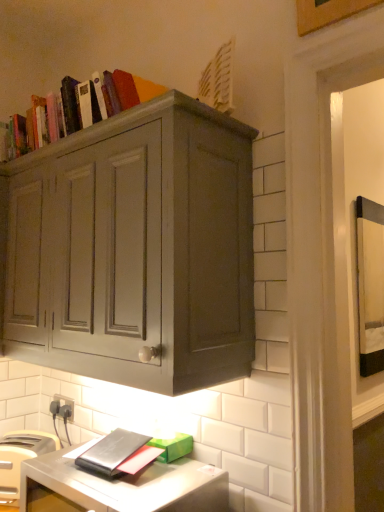
In order to face metallic silver computer desk at lower left, should I rotate leftwards or rightwards?

You should rotate left by 9.786 degrees.

Describe the element at coordinates (20, 460) in the screenshot. I see `white plastic toaster at lower left` at that location.

Describe the element at coordinates (66, 404) in the screenshot. I see `black plastic electric outlet at lower left` at that location.

Locate an element on the screen. metallic silver computer desk at lower left is located at coordinates (121, 486).

Can you confirm if metallic silver computer desk at lower left is smaller than white plastic toaster at lower left?

Incorrect, metallic silver computer desk at lower left is not smaller in size than white plastic toaster at lower left.

How different are the orientations of metallic silver computer desk at lower left and white plastic toaster at lower left in degrees?

The facing directions of metallic silver computer desk at lower left and white plastic toaster at lower left are 32.7 degrees apart.

In the image, is metallic silver computer desk at lower left positioned in front of or behind white plastic toaster at lower left?

metallic silver computer desk at lower left is positioned closer to the viewer than white plastic toaster at lower left.

Which of these two, metallic silver computer desk at lower left or white plastic toaster at lower left, is thinner?

With smaller width is white plastic toaster at lower left.

From a real-world perspective, is white plastic toaster at lower left positioned above or below wooden picture frame at upper right?

white plastic toaster at lower left is situated lower than wooden picture frame at upper right in the real world.

Does white plastic toaster at lower left come behind wooden picture frame at upper right?

Yes, the depth of white plastic toaster at lower left is greater than that of wooden picture frame at upper right.

Can you tell me how much white plastic toaster at lower left and wooden picture frame at upper right differ in facing direction?

The angle between the facing direction of white plastic toaster at lower left and the facing direction of wooden picture frame at upper right is 33.4 degrees.

Is white plastic toaster at lower left positioned with its back to wooden picture frame at upper right?

No.

Does black plastic electric outlet at lower left turn towards metallic silver computer desk at lower left?

No, black plastic electric outlet at lower left does not turn towards metallic silver computer desk at lower left.

Based on the photo, is black plastic electric outlet at lower left inside the boundaries of metallic silver computer desk at lower left, or outside?

black plastic electric outlet at lower left is located beyond the bounds of metallic silver computer desk at lower left.

Consider the image. From a real-world perspective, is black plastic electric outlet at lower left located beneath metallic silver computer desk at lower left?

No, from a real-world perspective, black plastic electric outlet at lower left is not beneath metallic silver computer desk at lower left.

From the image's perspective, is black plastic electric outlet at lower left on top of metallic silver computer desk at lower left?

Yes, from the image's perspective, black plastic electric outlet at lower left is above metallic silver computer desk at lower left.

Can you confirm if wooden picture frame at upper right is taller than white plastic toaster at lower left?

Yes, wooden picture frame at upper right is taller than white plastic toaster at lower left.

From the image's perspective, is wooden picture frame at upper right above white plastic toaster at lower left?

Yes, from the image's perspective, wooden picture frame at upper right is on top of white plastic toaster at lower left.

Considering the positions of point (321, 26) and point (47, 449), is point (321, 26) closer or farther from the camera than point (47, 449)?

Clearly, point (321, 26) is closer to the camera than point (47, 449).

Would you say wooden picture frame at upper right is outside white plastic toaster at lower left?

wooden picture frame at upper right lies outside white plastic toaster at lower left's area.

Does black plastic electric outlet at lower left have a greater height compared to matte gray cabinet at upper center?

Incorrect, the height of black plastic electric outlet at lower left is not larger of that of matte gray cabinet at upper center.

Is there a large distance between black plastic electric outlet at lower left and matte gray cabinet at upper center?

black plastic electric outlet at lower left is near matte gray cabinet at upper center, not far away.

Is black plastic electric outlet at lower left not inside matte gray cabinet at upper center?

Indeed, black plastic electric outlet at lower left is completely outside matte gray cabinet at upper center.

From a real-world perspective, relative to black plastic electric outlet at lower left, is metallic silver computer desk at lower left vertically above or below?

Clearly, from a real-world perspective, metallic silver computer desk at lower left is below black plastic electric outlet at lower left.

Is metallic silver computer desk at lower left oriented towards black plastic electric outlet at lower left?

No, metallic silver computer desk at lower left is not facing towards black plastic electric outlet at lower left.

In the scene shown: Does metallic silver computer desk at lower left appear on the right side of black plastic electric outlet at lower left?

Yes, metallic silver computer desk at lower left is to the right of black plastic electric outlet at lower left.

Identify the location of computer desk below the black plastic electric outlet at lower left (from the image's perspective). This screenshot has height=512, width=384. (121, 486).

Does wooden picture frame at upper right have a larger size compared to black plastic electric outlet at lower left?

Yes, wooden picture frame at upper right is bigger than black plastic electric outlet at lower left.

Does wooden picture frame at upper right turn towards black plastic electric outlet at lower left?

No, wooden picture frame at upper right is not turned towards black plastic electric outlet at lower left.

Which object is positioned more to the right, wooden picture frame at upper right or black plastic electric outlet at lower left?

wooden picture frame at upper right is more to the right.

I want to click on computer desk in front of the white plastic toaster at lower left, so click(121, 486).

Where is `picture frame above the white plastic toaster at lower left (from the image's perspective)`? The height and width of the screenshot is (512, 384). picture frame above the white plastic toaster at lower left (from the image's perspective) is located at coordinates (327, 12).

Based on the photo, based on their spatial positions, is metallic silver computer desk at lower left or white plastic toaster at lower left closer to matte gray cabinet at upper center?

metallic silver computer desk at lower left is closer to matte gray cabinet at upper center.

Which object lies further to the anchor point metallic silver computer desk at lower left, wooden picture frame at upper right or white plastic toaster at lower left?

wooden picture frame at upper right.

Looking at the image, which one is located further to white plastic toaster at lower left, black plastic electric outlet at lower left or metallic silver computer desk at lower left?

black plastic electric outlet at lower left.

When comparing their distances from metallic silver computer desk at lower left, does matte gray cabinet at upper center or black plastic electric outlet at lower left seem further?

black plastic electric outlet at lower left is positioned further to the anchor metallic silver computer desk at lower left.

From the picture: When comparing their distances from white plastic toaster at lower left, does black plastic electric outlet at lower left or matte gray cabinet at upper center seem further?

matte gray cabinet at upper center lies further to white plastic toaster at lower left than the other object.

Estimate the real-world distances between objects in this image. Which object is further from black plastic electric outlet at lower left, matte gray cabinet at upper center or white plastic toaster at lower left?

matte gray cabinet at upper center lies further to black plastic electric outlet at lower left than the other object.

Considering their positions, is wooden picture frame at upper right positioned further to matte gray cabinet at upper center than black plastic electric outlet at lower left?

black plastic electric outlet at lower left is further to matte gray cabinet at upper center.

From the image, which object appears to be nearer to black plastic electric outlet at lower left, metallic silver computer desk at lower left or white plastic toaster at lower left?

The object closer to black plastic electric outlet at lower left is white plastic toaster at lower left.

Image resolution: width=384 pixels, height=512 pixels. Find the location of `cabinetry between wooden picture frame at upper right and metallic silver computer desk at lower left in the up-down direction`. cabinetry between wooden picture frame at upper right and metallic silver computer desk at lower left in the up-down direction is located at coordinates (134, 249).

Locate an element on the screen. appliance between matte gray cabinet at upper center and black plastic electric outlet at lower left in the front-back direction is located at coordinates (20, 460).

The width and height of the screenshot is (384, 512). Find the location of `appliance positioned between metallic silver computer desk at lower left and black plastic electric outlet at lower left from near to far`. appliance positioned between metallic silver computer desk at lower left and black plastic electric outlet at lower left from near to far is located at coordinates (20, 460).

Find the location of a particular element. This screenshot has height=512, width=384. cabinetry between metallic silver computer desk at lower left and black plastic electric outlet at lower left from front to back is located at coordinates (134, 249).